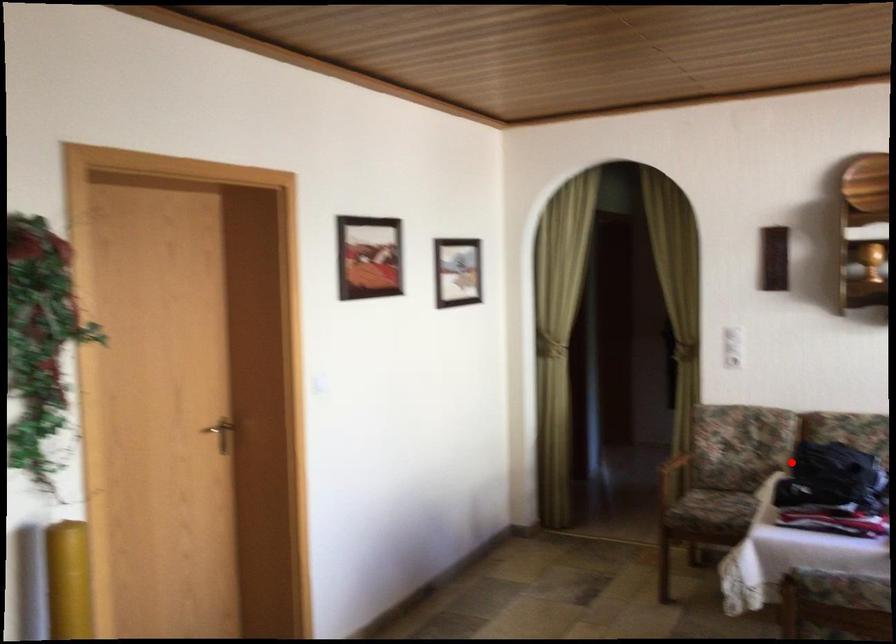
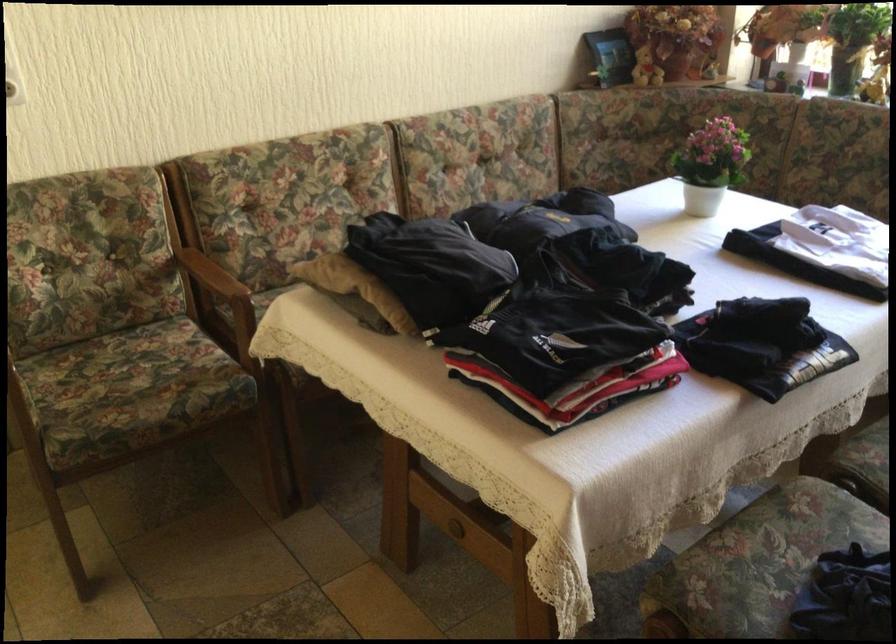
Question: I am providing you with two images of the same scene from different viewpoints. Image1 has a red point marked. In image2, the corresponding 3D location appears at what relative position? Reply with the corresponding letter.

Choices:
 (A) Closer
 (B) Farther

Answer: (A)